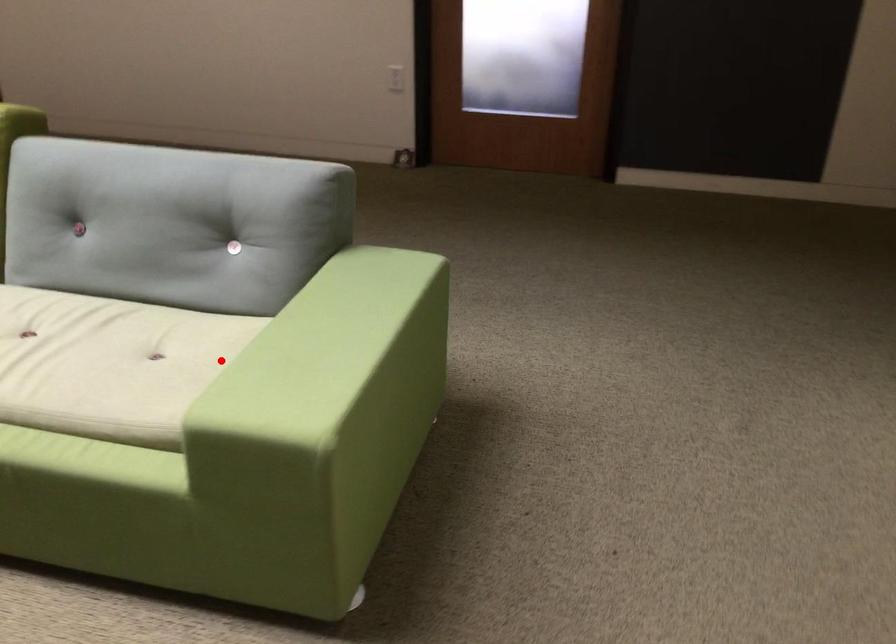
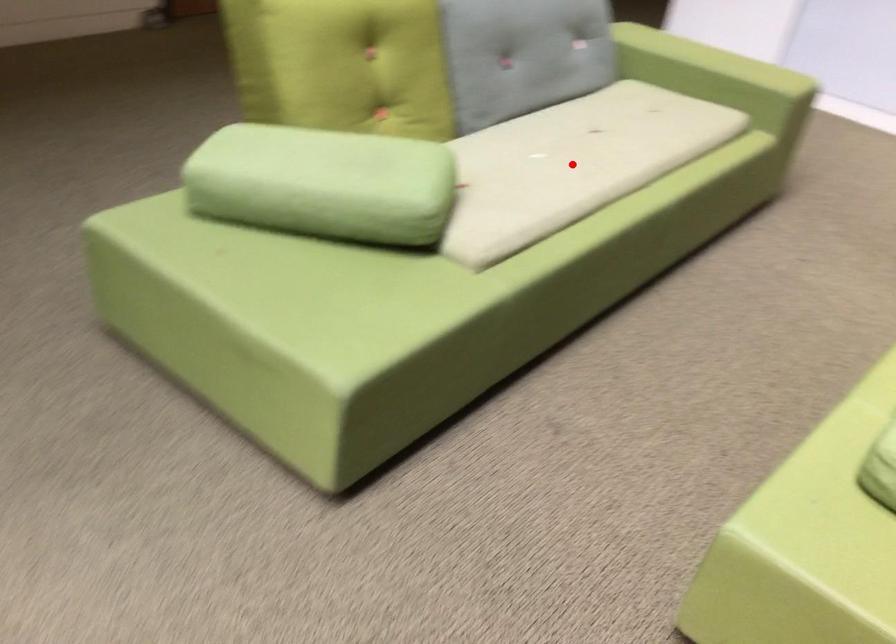
I am providing you with two images of the same scene from different viewpoints. A red point is marked on the first image and another point is marked on the second image. Is the red point in image1 aligned with the point shown in image2?

No